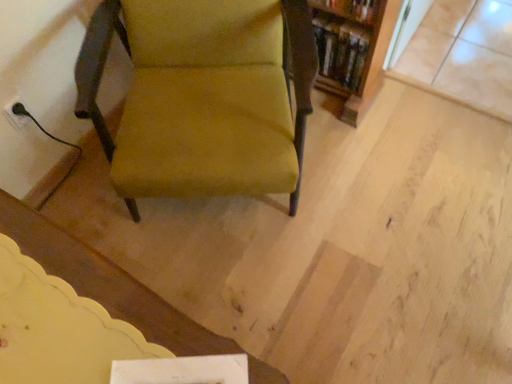
Find the location of a particular element. The width and height of the screenshot is (512, 384). velvet mustard chair at center is located at coordinates (203, 116).

Describe the element at coordinates (203, 116) in the screenshot. I see `velvet mustard chair at center` at that location.

Locate an element on the screen. wooden bookshelf at upper right is located at coordinates (353, 49).

What is the approximate height of wooden bookshelf at upper right?

10.59 inches.

Image resolution: width=512 pixels, height=384 pixels. Describe the element at coordinates (353, 49) in the screenshot. I see `wooden bookshelf at upper right` at that location.

Locate an element on the screen. The height and width of the screenshot is (384, 512). velvet mustard chair at center is located at coordinates pyautogui.click(x=203, y=116).

Between velvet mustard chair at center and wooden bookshelf at upper right, which one appears on the left side from the viewer's perspective?

From the viewer's perspective, velvet mustard chair at center appears more on the left side.

Is velvet mustard chair at center behind wooden bookshelf at upper right?

No, velvet mustard chair at center is closer to the camera.

Considering the points (106, 33) and (364, 111), which point is behind, point (106, 33) or point (364, 111)?

The point (364, 111) is behind.

From the image's perspective, is velvet mustard chair at center located above or below wooden bookshelf at upper right?

From the image's perspective, velvet mustard chair at center appears below wooden bookshelf at upper right.

Based on the photo, from a real-world perspective, who is located higher, velvet mustard chair at center or wooden bookshelf at upper right?

In real-world perspective, velvet mustard chair at center is above.

Is velvet mustard chair at center wider or thinner than wooden bookshelf at upper right?

velvet mustard chair at center is wider than wooden bookshelf at upper right.

Considering the relative sizes of velvet mustard chair at center and wooden bookshelf at upper right in the image provided, is velvet mustard chair at center shorter than wooden bookshelf at upper right?

No.

Looking at the image, does velvet mustard chair at center seem bigger or smaller compared to wooden bookshelf at upper right?

Clearly, velvet mustard chair at center is larger in size than wooden bookshelf at upper right.

Is velvet mustard chair at center not inside wooden bookshelf at upper right?

Indeed, velvet mustard chair at center is completely outside wooden bookshelf at upper right.

Would you say velvet mustard chair at center is a long distance from wooden bookshelf at upper right?

Actually, velvet mustard chair at center and wooden bookshelf at upper right are a little close together.

Is velvet mustard chair at center looking in the opposite direction of wooden bookshelf at upper right?

No, velvet mustard chair at center's orientation is not away from wooden bookshelf at upper right.

What's the angular difference between velvet mustard chair at center and wooden bookshelf at upper right's facing directions?

There is a 28.6-degree angle between the facing directions of velvet mustard chair at center and wooden bookshelf at upper right.

How much distance is there between velvet mustard chair at center and wooden bookshelf at upper right?

velvet mustard chair at center is 20.60 inches from wooden bookshelf at upper right.

Identify the location of shelf behind the velvet mustard chair at center. This screenshot has width=512, height=384. (353, 49).

Which is more to the right, wooden bookshelf at upper right or velvet mustard chair at center?

From the viewer's perspective, wooden bookshelf at upper right appears more on the right side.

Does wooden bookshelf at upper right come behind velvet mustard chair at center?

Yes.

Is point (360, 60) closer or farther from the camera than point (308, 104)?

Clearly, point (360, 60) is more distant from the camera than point (308, 104).

From the image's perspective, is wooden bookshelf at upper right positioned above or below velvet mustard chair at center?

Clearly, from the image's perspective, wooden bookshelf at upper right is above velvet mustard chair at center.

From a real-world perspective, which is physically below, wooden bookshelf at upper right or velvet mustard chair at center?

wooden bookshelf at upper right, from a real-world perspective.

Which object is thinner, wooden bookshelf at upper right or velvet mustard chair at center?

wooden bookshelf at upper right.

Considering the sizes of objects wooden bookshelf at upper right and velvet mustard chair at center in the image provided, who is taller, wooden bookshelf at upper right or velvet mustard chair at center?

With more height is velvet mustard chair at center.

Considering the sizes of objects wooden bookshelf at upper right and velvet mustard chair at center in the image provided, who is smaller, wooden bookshelf at upper right or velvet mustard chair at center?

wooden bookshelf at upper right.

Would you say wooden bookshelf at upper right contains velvet mustard chair at center?

No, wooden bookshelf at upper right does not contain velvet mustard chair at center.

Is wooden bookshelf at upper right touching velvet mustard chair at center?

They are not placed beside each other.

Is velvet mustard chair at center at the back of wooden bookshelf at upper right?

No, wooden bookshelf at upper right is not facing away from velvet mustard chair at center.

Consider the image. Can you tell me how much wooden bookshelf at upper right and velvet mustard chair at center differ in facing direction?

The angular difference between wooden bookshelf at upper right and velvet mustard chair at center is 28.6 degrees.

How distant is wooden bookshelf at upper right from velvet mustard chair at center?

20.60 inches.

Locate an element on the screen. chair above the wooden bookshelf at upper right (from a real-world perspective) is located at coordinates (203, 116).

The height and width of the screenshot is (384, 512). In order to click on chair located below the wooden bookshelf at upper right (from the image's perspective) in this screenshot , I will do `click(203, 116)`.

The image size is (512, 384). I want to click on shelf to the right of velvet mustard chair at center, so click(x=353, y=49).